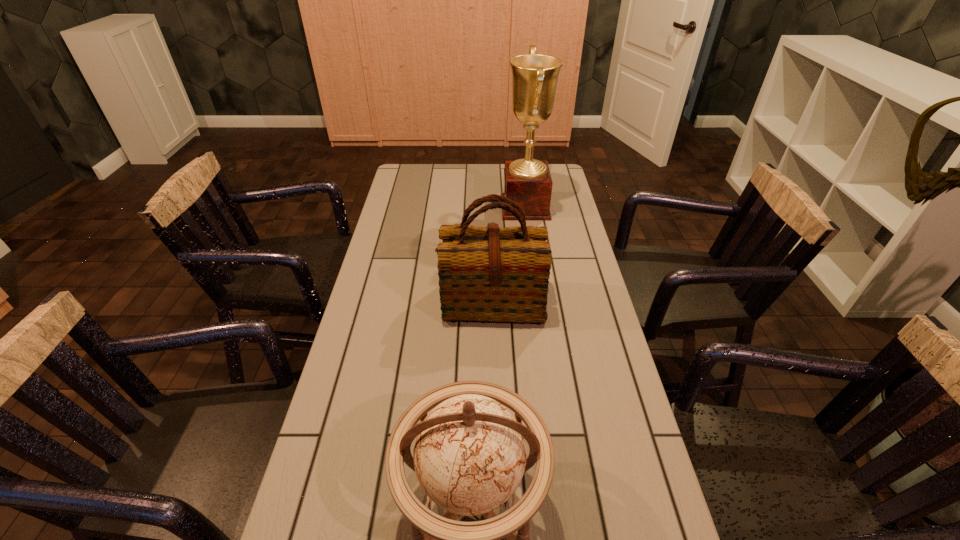
In the image, there is a desktop. Identify the location of free region at the left edge. The image size is (960, 540). (407, 295).

Identify the location of blank space at the right edge of the desktop. This screenshot has height=540, width=960. 641,491.

Identify the location of the second closest object to the tallest object. (469, 455).

Select which object appears as the closest to the second nearest object. Please provide its 2D coordinates. Your answer should be formatted as a tuple, i.e. [(x, y)], where the tuple contains the x and y coordinates of a point satisfying the conditions above.

[(527, 181)]

Locate an element on the screen. vacant point that satisfies the following two spatial constraints: 1. on the plaque of the farthest object; 2. on the open handle side of the shopping bag is located at coordinates (539, 302).

This screenshot has width=960, height=540. What are the coordinates of `free space in the image that satisfies the following two spatial constraints: 1. on the plaque of the tallest object; 2. on the open handle side of the shopping bag` in the screenshot? It's located at (539, 302).

Find the location of a particular element. This screenshot has height=540, width=960. free space that satisfies the following two spatial constraints: 1. on the plaque of the tallest object; 2. on the open handle side of the second farthest object is located at coordinates tap(539, 302).

Locate an element on the screen. This screenshot has width=960, height=540. vacant space that satisfies the following two spatial constraints: 1. on the plaque of the tallest object; 2. on the open handle side of the second farthest object is located at coordinates (539, 302).